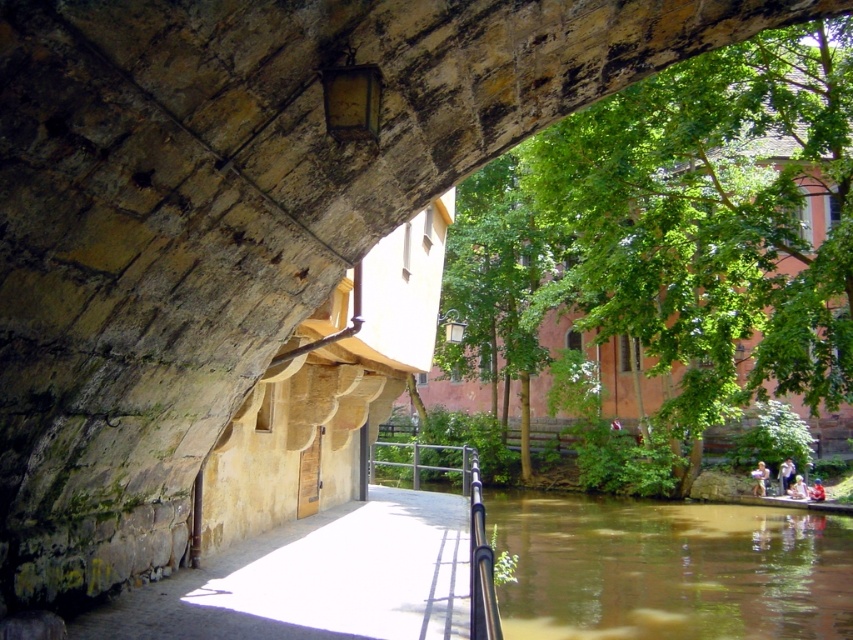
You are a delivery person carrying a package that requires a cool place. You see the green leafy tree at center and the brown murky water at lower right. Which of these two locations is cooler?

The brown murky water at lower right is cooler because it is shaded by the bridge and the walkway, while the green leafy tree at center is in the sunlight.

From the picture: You are a tourist standing on the walkway under the stone bridge. You see a green leafy tree at center and brown murky water at lower right. Which object is located to the right side of the other?

The green leafy tree at center is to the right of brown murky water at lower right.